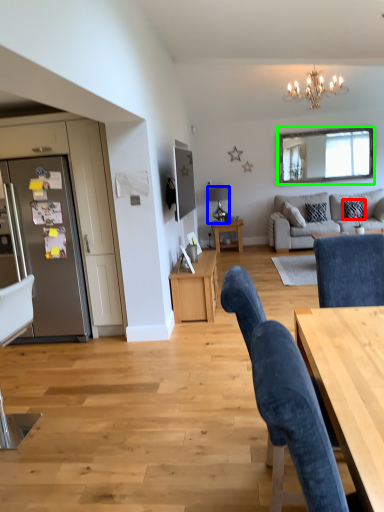
Question: Which object is positioned closest to pillow (highlighted by a red box)? Select from lamp (highlighted by a blue box) and mirror (highlighted by a green box).

Choices:
 (A) lamp
 (B) mirror

Answer: (B)